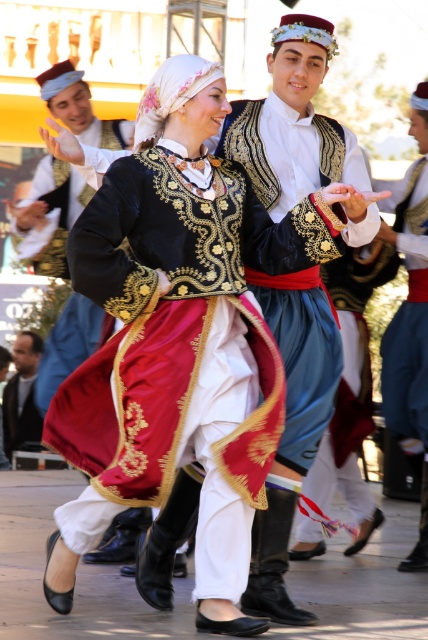
Does point (332, 372) lie in front of point (47, 232)?

Yes, point (332, 372) is closer to viewer.

Between shiny blue fabric at center and matte black vest at center, which one is positioned higher?

matte black vest at center is higher up.

What do you see at coordinates (297, 131) in the screenshot? The width and height of the screenshot is (428, 640). I see `shiny blue fabric at center` at bounding box center [297, 131].

Find the location of a particular element. The image size is (428, 640). shiny blue fabric at center is located at coordinates (297, 131).

Is matte black vest at center to the right of dark blue fabric jacket at lower left from the viewer's perspective?

Yes, matte black vest at center is to the right of dark blue fabric jacket at lower left.

Between point (71, 67) and point (26, 380), which one is positioned in front?

Point (71, 67) is in front.

Does point (20, 243) come behind point (26, 340)?

No, (20, 243) is in front of (26, 340).

Find the location of a particular element. This screenshot has width=428, height=640. matte black vest at center is located at coordinates (50, 216).

Does velvet red skirt at center appear over shiny blue fabric at center?

No.

Can you confirm if velvet red skirt at center is wider than shiny blue fabric at center?

Yes, velvet red skirt at center is wider than shiny blue fabric at center.

Find the location of a particular element. This screenshot has width=428, height=640. velvet red skirt at center is located at coordinates (180, 339).